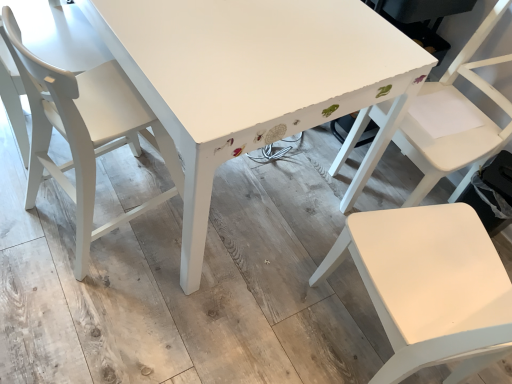
Image resolution: width=512 pixels, height=384 pixels. I want to click on vacant area that is situated to the right of matte white chair at left, which is the 1th chair from left to right, so click(221, 242).